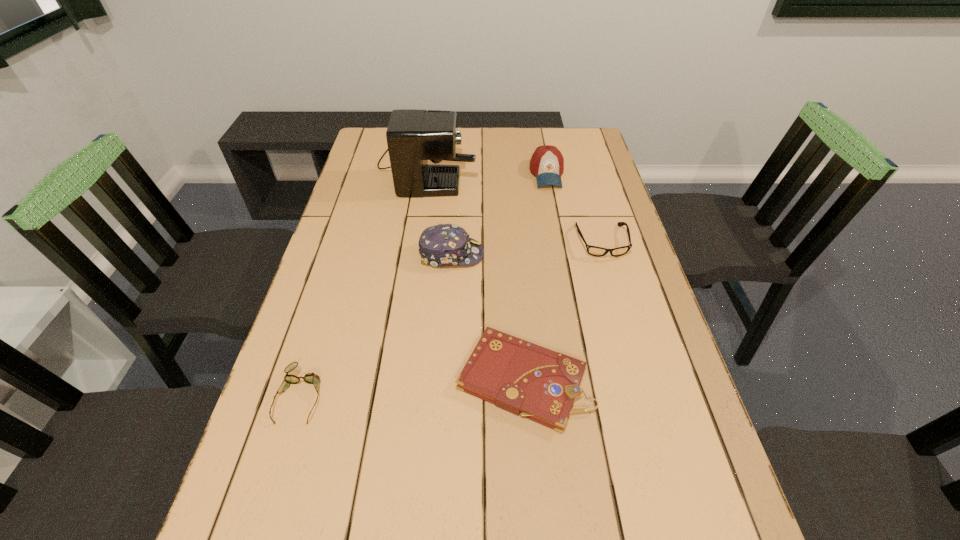
You are a GUI agent. You are given a task and a screenshot of the screen. Output one action in this format:
    pyautogui.click(x=<x>, y=<y>)
    Task: Click on the vacant region between the notebook and the tallest object
    Image resolution: width=960 pixels, height=540 pixels.
    Given the screenshot: What is the action you would take?
    pyautogui.click(x=475, y=272)

Find the location of a particular element. vacant area that lies between the headwear and the tallest object is located at coordinates (440, 209).

Where is `free spot between the taller spectacles and the tallest object`? This screenshot has width=960, height=540. free spot between the taller spectacles and the tallest object is located at coordinates (515, 203).

The width and height of the screenshot is (960, 540). In order to click on free spot between the coffee maker and the baseball cap in this screenshot , I will do `click(487, 169)`.

I want to click on the second closest object to the coffee maker, so click(x=445, y=244).

This screenshot has height=540, width=960. In order to click on object that is the closest to the baseball cap in this screenshot , I will do (x=595, y=251).

Locate an element on the screen. Image resolution: width=960 pixels, height=540 pixels. vacant space that satisfies the following two spatial constraints: 1. on the front-facing side of the notebook; 2. on the right side of the headwear is located at coordinates (443, 380).